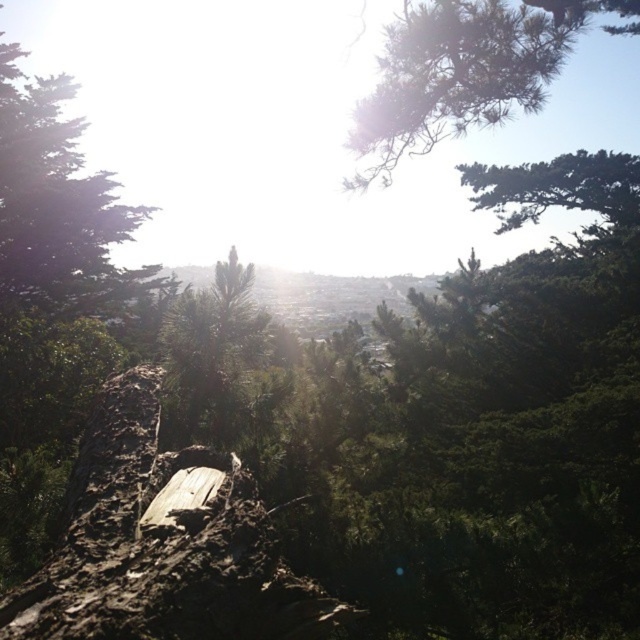
Question: Which object is closer to the camera taking this photo?

Choices:
 (A) green textured pine branch at upper center
 (B) green matte tree at upper left

Answer: (A)

Question: Which point is farther to the camera?

Choices:
 (A) weathered wood log at center
 (B) green matte tree at upper left

Answer: (B)

Question: Is weathered wood log at center smaller than green textured pine branch at upper center?

Choices:
 (A) no
 (B) yes

Answer: (B)

Question: Is weathered wood log at center smaller than green matte tree at upper left?

Choices:
 (A) yes
 (B) no

Answer: (A)

Question: Which of the following is the closest to the observer?

Choices:
 (A) (403, 40)
 (B) (17, 202)
 (C) (90, 426)

Answer: (C)

Question: Is green matte tree at upper left wider than green textured pine branch at upper center?

Choices:
 (A) no
 (B) yes

Answer: (B)